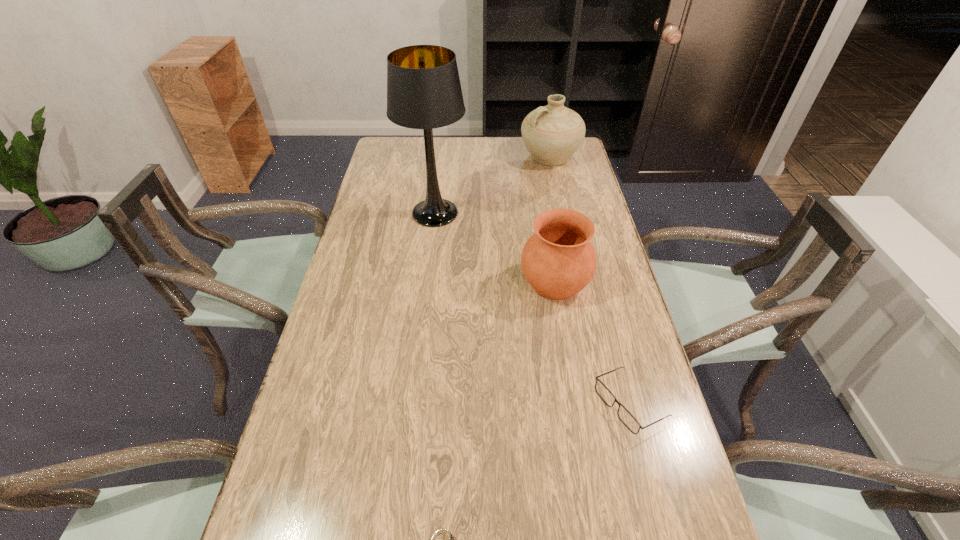
Image resolution: width=960 pixels, height=540 pixels. In order to click on the tallest object in this screenshot , I will do `click(424, 92)`.

Image resolution: width=960 pixels, height=540 pixels. I want to click on the fourth nearest object, so click(x=424, y=92).

Where is `the farther pottery`? This screenshot has height=540, width=960. the farther pottery is located at coordinates (552, 134).

Image resolution: width=960 pixels, height=540 pixels. I want to click on the nearer pottery, so tap(558, 260).

Where is `the third nearest object`? The height and width of the screenshot is (540, 960). the third nearest object is located at coordinates (558, 260).

Identify the location of the fourth farthest object. This screenshot has height=540, width=960. (625, 416).

The image size is (960, 540). Identify the location of spectacles. (625, 416).

The width and height of the screenshot is (960, 540). In order to click on free location located 0.340m on the front of the second farthest object in this screenshot , I will do `click(423, 315)`.

You are a GUI agent. You are given a task and a screenshot of the screen. Output one action in this format:
    pyautogui.click(x=<x>, y=<y>)
    Task: Click on the blank area located 0.090m on the front of the farthest object
    This screenshot has height=540, width=960.
    Given the screenshot: What is the action you would take?
    pyautogui.click(x=557, y=186)

The width and height of the screenshot is (960, 540). I want to click on free location located on the front of the shorter pottery, so click(x=565, y=349).